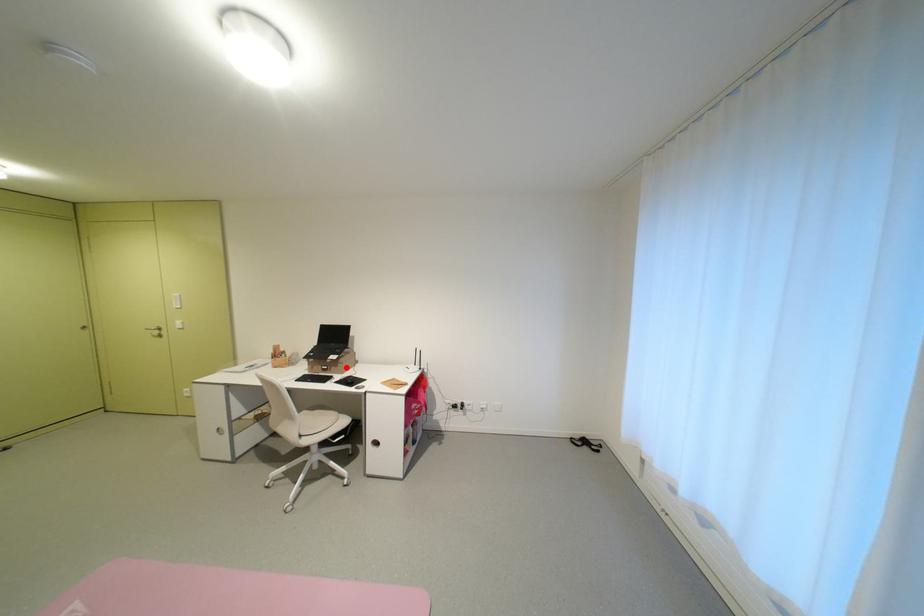
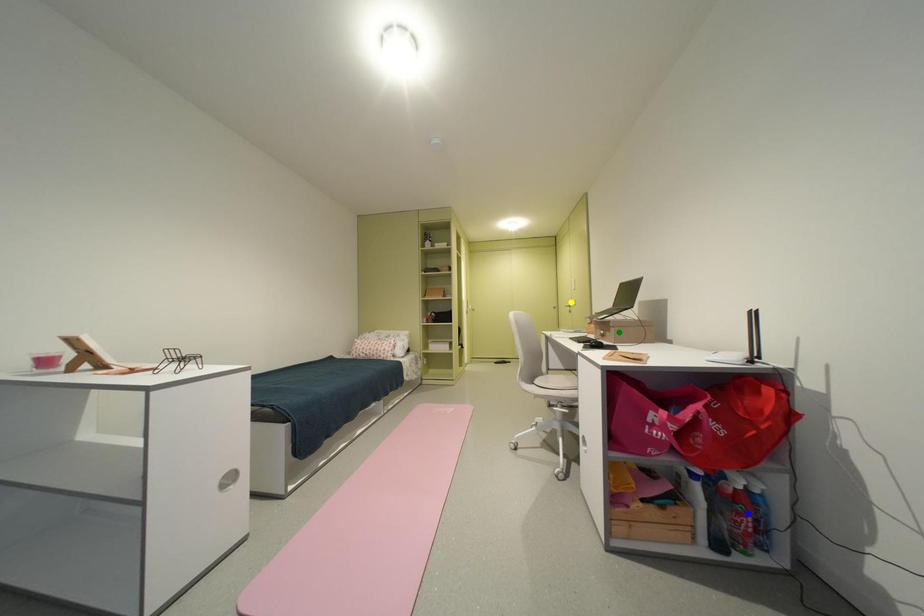
Question: I am providing you with two images of the same scene from different viewpoints. A red point is marked on the first image. You are given multiple points on the second image. Which mark in image 2 goes with the point in image 1?

Choices:
 (A) green point
 (B) yellow point
 (C) blue point

Answer: (A)